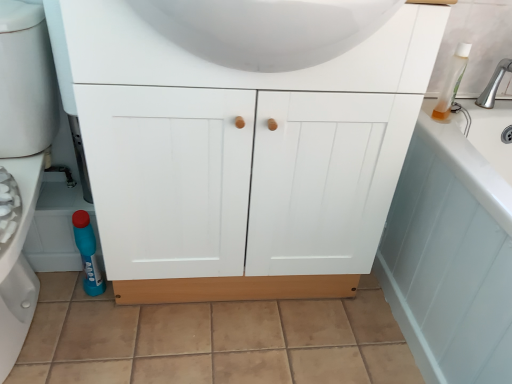
Find the location of a particular element. The image size is (512, 384). blue plastic bottle at lower left is located at coordinates [88, 253].

This screenshot has width=512, height=384. What are the coordinates of `white glossy sink at upper center` in the screenshot? It's located at (266, 29).

The width and height of the screenshot is (512, 384). Describe the element at coordinates (22, 155) in the screenshot. I see `blue glossy cleaner bottle at lower left` at that location.

This screenshot has width=512, height=384. I want to click on translucent plastic bottle at upper right, so click(451, 81).

Find the location of a particular element. Image resolution: width=512 pixels, height=384 pixels. blue plastic bottle at lower left is located at coordinates (88, 253).

Is light blue wood bath at lower right far from translucent plastic bottle at upper right?

No, light blue wood bath at lower right is not far from translucent plastic bottle at upper right.

Does light blue wood bath at lower right come behind translucent plastic bottle at upper right?

No, light blue wood bath at lower right is closer to the camera.

Is light blue wood bath at lower right completely or partially outside of translucent plastic bottle at upper right?

→ Yes, light blue wood bath at lower right is located beyond the bounds of translucent plastic bottle at upper right.

Which point is more forward, (473,346) or (448,103)?

Point (473,346)

Would you say blue plastic bottle at lower left is a long distance from beige ceramic tile at lower center?

No, blue plastic bottle at lower left is not far away from beige ceramic tile at lower center.

From the image's perspective, between blue plastic bottle at lower left and beige ceramic tile at lower center, which one is located above?

blue plastic bottle at lower left appears higher in the image.

From a real-world perspective, is blue plastic bottle at lower left physically located above or below beige ceramic tile at lower center?

From a real-world perspective, blue plastic bottle at lower left is physically above beige ceramic tile at lower center.

Which of these two, brushed metal faucet at upper right or white glossy sink at upper center, is thinner?

brushed metal faucet at upper right is thinner.

From the image's perspective, is brushed metal faucet at upper right under white glossy sink at upper center?

Correct, brushed metal faucet at upper right appears lower than white glossy sink at upper center in the image.

Is brushed metal faucet at upper right spatially inside white glossy sink at upper center, or outside of it?

brushed metal faucet at upper right is not enclosed by white glossy sink at upper center.

Could you tell me if white matte cabinet at center is facing translucent plastic bottle at upper right?

No, white matte cabinet at center is not oriented towards translucent plastic bottle at upper right.

Does white matte cabinet at center have a larger size compared to translucent plastic bottle at upper right?

Yes.

In the image, there is a white matte cabinet at center. In order to click on cleaning product above it (from the image's perspective) in this screenshot , I will do `click(451, 81)`.

Considering the relative sizes of white matte cabinet at center and translucent plastic bottle at upper right in the image provided, is white matte cabinet at center wider than translucent plastic bottle at upper right?

Indeed, white matte cabinet at center has a greater width compared to translucent plastic bottle at upper right.

From their relative heights in the image, would you say white matte cabinet at center is taller or shorter than brushed metal faucet at upper right?

white matte cabinet at center is taller than brushed metal faucet at upper right.

From the image's perspective, which is above, white matte cabinet at center or brushed metal faucet at upper right?

brushed metal faucet at upper right is shown above in the image.

Which object is more forward, white matte cabinet at center or brushed metal faucet at upper right?

white matte cabinet at center is closer to the camera.

Is white matte cabinet at center looking in the opposite direction of brushed metal faucet at upper right?

white matte cabinet at center is not turned away from brushed metal faucet at upper right.

Is beige ceramic tile at lower center surrounded by translucent plastic bottle at upper right?

That's incorrect, beige ceramic tile at lower center is not inside translucent plastic bottle at upper right.

Is point (452, 74) farther from viewer compared to point (204, 310)?

No, it is in front of (204, 310).

Considering the sizes of objects translucent plastic bottle at upper right and beige ceramic tile at lower center in the image provided, who is smaller, translucent plastic bottle at upper right or beige ceramic tile at lower center?

Smaller between the two is translucent plastic bottle at upper right.

Looking at this image, in the image, is translucent plastic bottle at upper right positioned in front of or behind beige ceramic tile at lower center?

translucent plastic bottle at upper right is positioned farther from the viewer than beige ceramic tile at lower center.

Does point (243, 275) lie behind point (500, 284)?

Yes, it is.

From the image's perspective, does white matte cabinet at center appear lower than light blue wood bath at lower right?

Actually, white matte cabinet at center appears above light blue wood bath at lower right in the image.

Considering the positions of objects white matte cabinet at center and light blue wood bath at lower right in the image provided, who is more to the right, white matte cabinet at center or light blue wood bath at lower right?

From the viewer's perspective, light blue wood bath at lower right appears more on the right side.

Is white matte cabinet at center oriented away from light blue wood bath at lower right?

No, white matte cabinet at center's orientation is not away from light blue wood bath at lower right.

Image resolution: width=512 pixels, height=384 pixels. In order to click on cleaning product on the left of light blue wood bath at lower right in this screenshot , I will do tap(451, 81).

At what (x,y) coordinates should I click in order to perform the action: click on bottle that appears behind the beige ceramic tile at lower center. Please return your answer as a coordinate pair (x, y). This screenshot has height=384, width=512. Looking at the image, I should click on (88, 253).

Estimate the real-world distances between objects in this image. Which object is closer to white glossy sink at upper center, blue plastic bottle at lower left or beige ceramic tile at lower center?

blue plastic bottle at lower left is positioned closer to the anchor white glossy sink at upper center.

From the image, which object appears to be nearer to light blue wood bath at lower right, white glossy sink at upper center or white matte cabinet at center?

The object closer to light blue wood bath at lower right is white matte cabinet at center.

Estimate the real-world distances between objects in this image. Which object is closer to translucent plastic bottle at upper right, blue glossy cleaner bottle at lower left or white matte cabinet at center?

Among the two, white matte cabinet at center is located nearer to translucent plastic bottle at upper right.

Which object lies further to the anchor point beige ceramic tile at lower center, white matte cabinet at center or brushed metal faucet at upper right?

The object further to beige ceramic tile at lower center is brushed metal faucet at upper right.

Which object lies further to the anchor point beige ceramic tile at lower center, brushed metal faucet at upper right or blue plastic bottle at lower left?

brushed metal faucet at upper right is further to beige ceramic tile at lower center.

Considering their positions, is white glossy sink at upper center positioned closer to light blue wood bath at lower right than brushed metal faucet at upper right?

The object closer to light blue wood bath at lower right is brushed metal faucet at upper right.

Based on their spatial positions, is beige ceramic tile at lower center or blue plastic bottle at lower left further from white glossy sink at upper center?

beige ceramic tile at lower center is positioned further to the anchor white glossy sink at upper center.

Based on their spatial positions, is white glossy sink at upper center or brushed metal faucet at upper right closer to blue plastic bottle at lower left?

Among the two, white glossy sink at upper center is located nearer to blue plastic bottle at lower left.

You are a GUI agent. You are given a task and a screenshot of the screen. Output one action in this format:
    pyautogui.click(x=<x>, y=<y>)
    Task: Click on the ceramic tile between blue plastic bottle at lower left and light blue wood bath at lower right from left to right
    The height and width of the screenshot is (384, 512).
    Given the screenshot: What is the action you would take?
    pyautogui.click(x=211, y=340)

The image size is (512, 384). In order to click on bathroom cabinet between beige ceramic tile at lower center and translucent plastic bottle at upper right in the horizontal direction in this screenshot , I will do `click(242, 157)`.

This screenshot has height=384, width=512. Find the location of `sink between blue glossy cleaner bottle at lower left and light blue wood bath at lower right`. sink between blue glossy cleaner bottle at lower left and light blue wood bath at lower right is located at coordinates (266, 29).

Locate an element on the screen. ceramic tile between blue glossy cleaner bottle at lower left and blue plastic bottle at lower left from front to back is located at coordinates (211, 340).